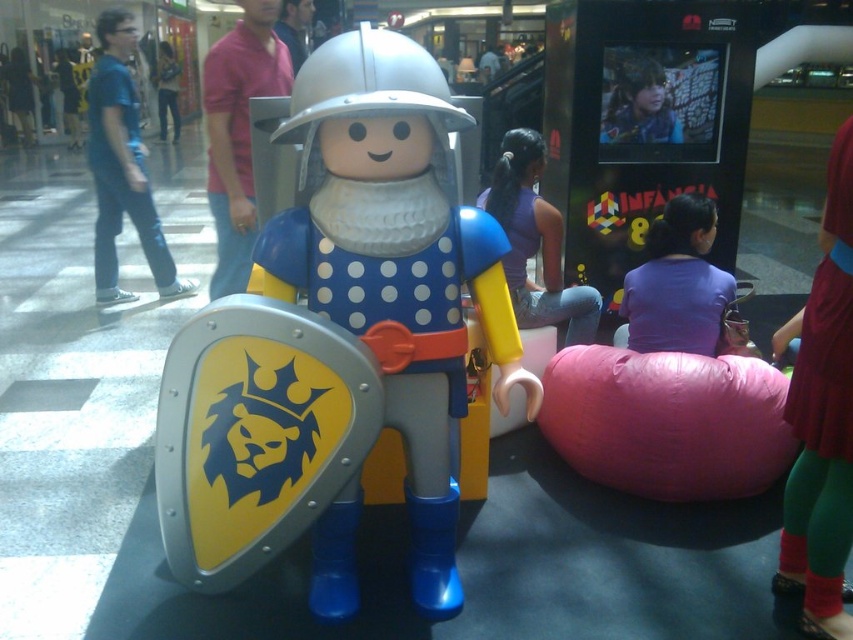
You are standing in the shopping mall and want to take a photo of the Playmobil knight figure. There are two points marked in the scene. The first point is at coordinates point (828, 260) and the second point is at coordinates point (148, 243). Which point is closer to the camera so that you can focus on it for better clarity?

Point (828, 260) is closer to the camera than point (148, 243), so focusing on it will ensure better clarity.

You are standing in a shopping mall and see the red fabric dress at lower right. If you want to pick it up, will you be able to reach it without moving your feet?

The red fabric dress at lower right is 1.77 meters away from the viewer. Since the average arm length is about 0.7 meters, you cannot reach it without moving your feet.

Based on the photo, you are standing in a shopping mall and see a Playmobil knight figure in front of you. There are people in the background. Where is the matte blue jeans at left located in relation to the Playmobil knight figure?

The matte blue jeans at left is located at point (122, 166) relative to the Playmobil knight figure.